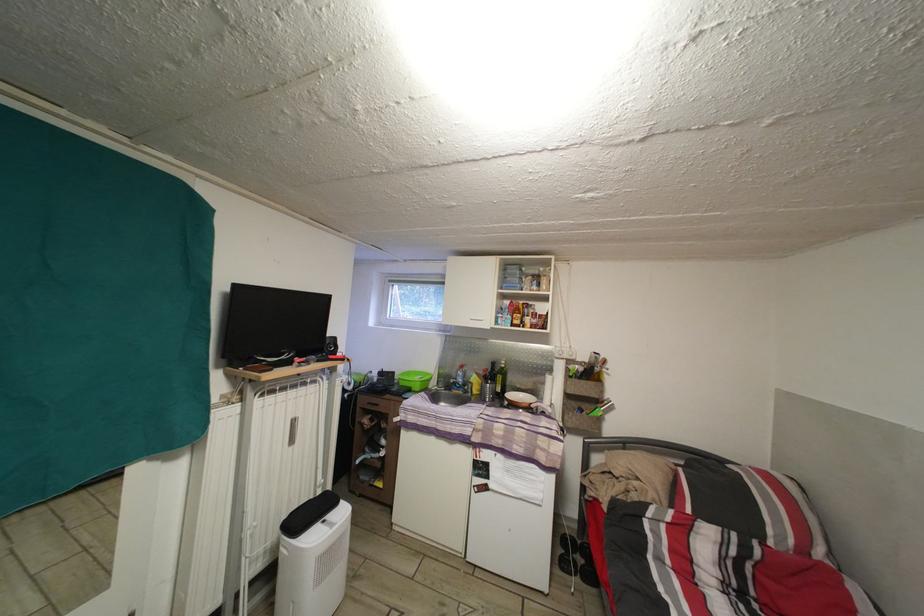
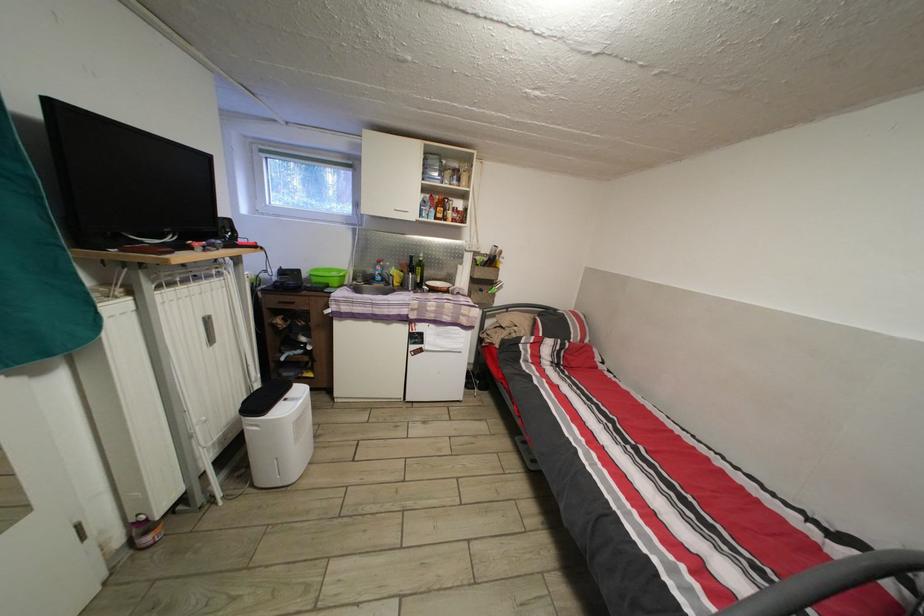
Where in the second image is the point corresponding to point 500,371 from the first image?

(419, 265)